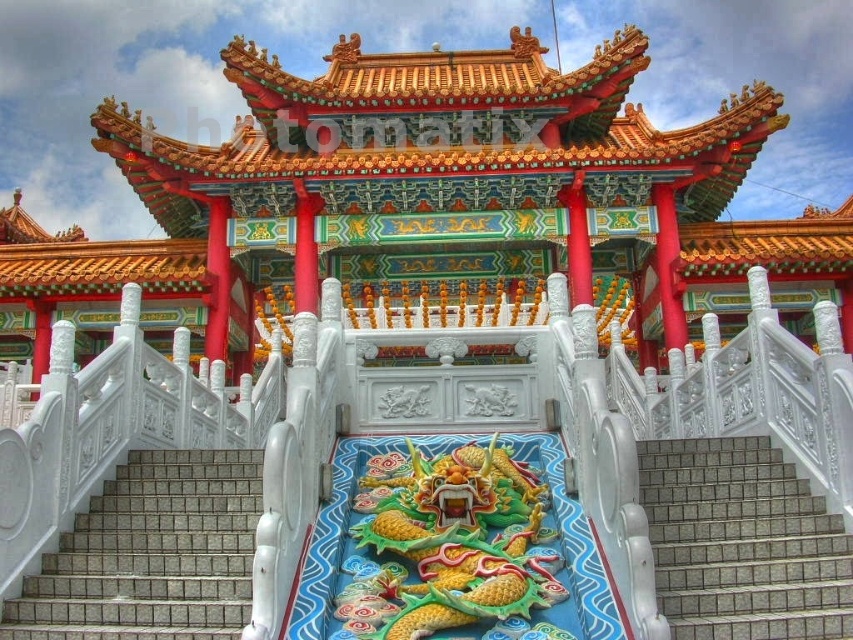
From the picture: Does white tile stairs at center have a greater width compared to gray tile stairs at center?

Yes.

Can you confirm if white tile stairs at center is positioned to the left of gray tile stairs at center?

Indeed, white tile stairs at center is positioned on the left side of gray tile stairs at center.

Does point (49, 609) come in front of point (772, 538)?

Yes, it is.

Locate an element on the screen. This screenshot has height=640, width=853. white tile stairs at center is located at coordinates (151, 554).